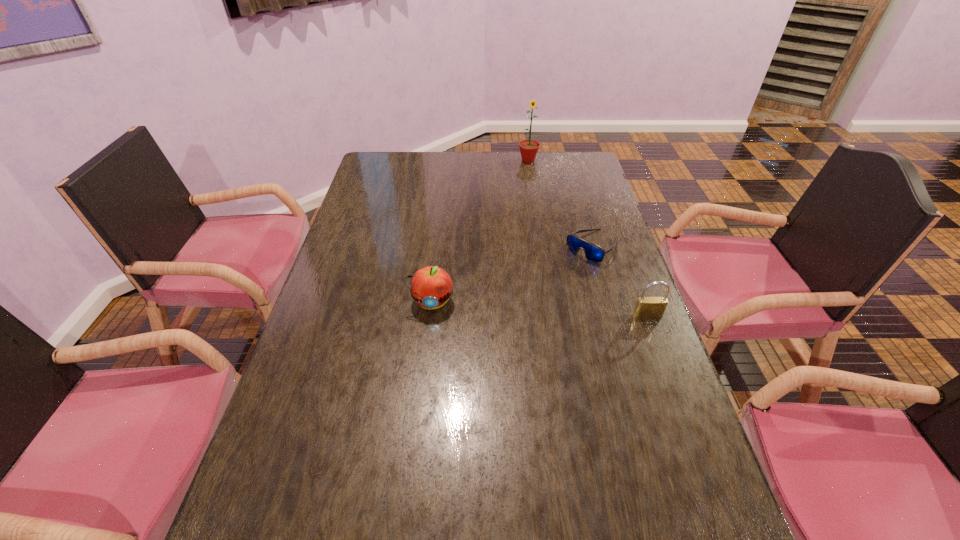
Where is `free space between the sunglasses and the farthest object`? free space between the sunglasses and the farthest object is located at coordinates (561, 204).

The height and width of the screenshot is (540, 960). I want to click on empty space between the sunflower and the sunglasses, so click(561, 204).

Identify which object is the third nearest to the apple. Please provide its 2D coordinates. Your answer should be formatted as a tuple, i.e. [(x, y)], where the tuple contains the x and y coordinates of a point satisfying the conditions above.

[(528, 148)]

Point out which object is positioned as the second nearest to the farthest object. Please provide its 2D coordinates. Your answer should be formatted as a tuple, i.e. [(x, y)], where the tuple contains the x and y coordinates of a point satisfying the conditions above.

[(431, 286)]